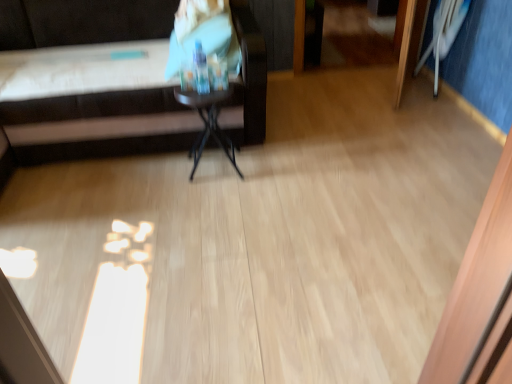
The width and height of the screenshot is (512, 384). Find the location of `vacant space in front of black glossy side table at center`. vacant space in front of black glossy side table at center is located at coordinates (214, 200).